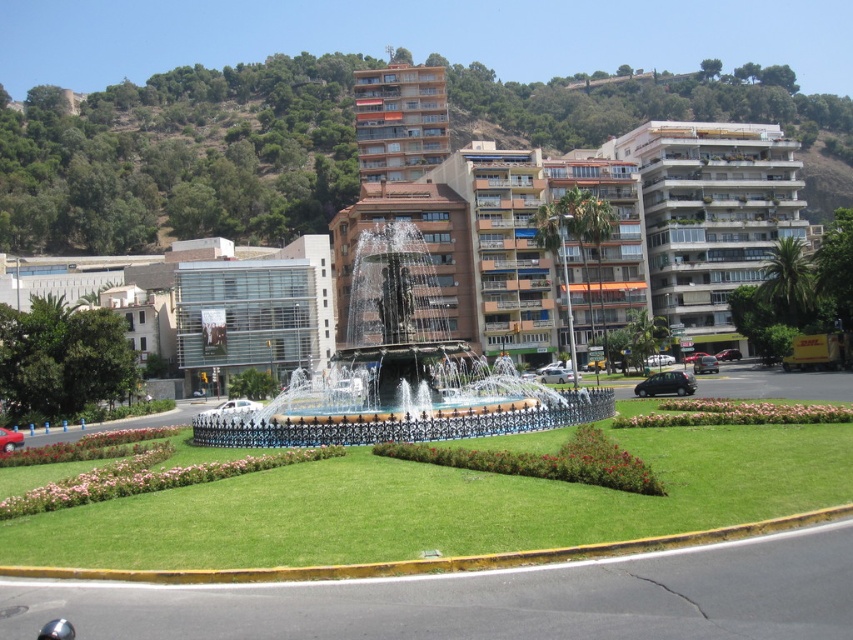
Question: Based on their relative distances, which object is nearer to the black stone fountain at center?

Choices:
 (A) white glossy building at upper right
 (B) orange glass windows at center

Answer: (A)

Question: Can you confirm if black stone fountain at center is wider than white glossy building at upper right?

Choices:
 (A) no
 (B) yes

Answer: (A)

Question: Does white glossy building at upper right appear on the right side of orange glass windows at center?

Choices:
 (A) yes
 (B) no

Answer: (A)

Question: Is black stone fountain at center positioned before orange glass windows at center?

Choices:
 (A) no
 (B) yes

Answer: (B)

Question: Estimate the real-world distances between objects in this image. Which object is closer to the orange glass windows at center?

Choices:
 (A) white glossy building at upper right
 (B) black stone fountain at center

Answer: (A)

Question: Which object is farther from the camera taking this photo?

Choices:
 (A) white glossy building at upper right
 (B) orange glass windows at center
 (C) black stone fountain at center

Answer: (B)